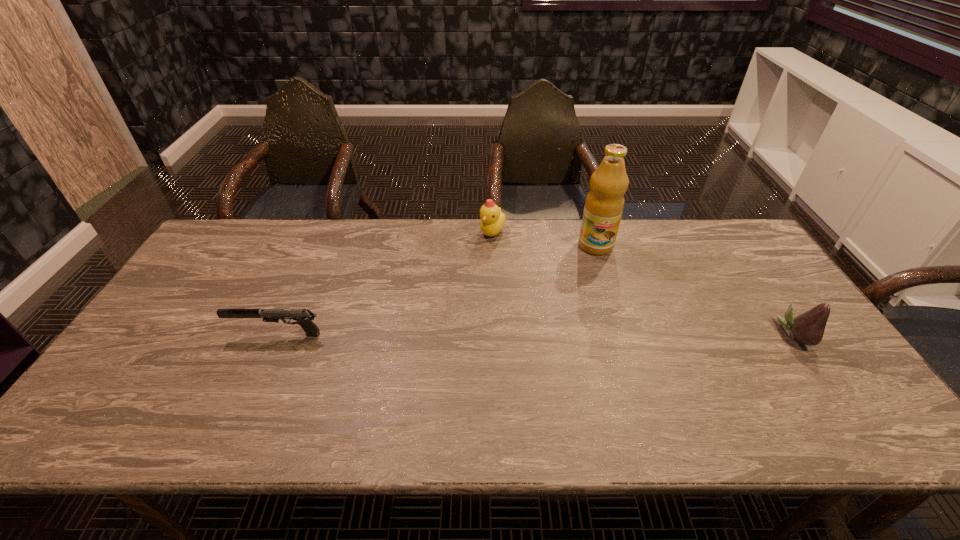
The height and width of the screenshot is (540, 960). I want to click on vacant region at the left edge of the desktop, so click(199, 282).

In the image, there is a desktop. Identify the location of free region at the right edge. (833, 372).

Locate an element on the screen. The image size is (960, 540). vacant area at the far left corner of the desktop is located at coordinates (241, 243).

This screenshot has width=960, height=540. Identify the location of vacant point at the far right corner. (710, 241).

The width and height of the screenshot is (960, 540). Identify the location of vacant region at the near right corner. (849, 397).

Locate an element on the screen. The height and width of the screenshot is (540, 960). vacant space in between the duckling and the shortest object is located at coordinates (385, 284).

Find the location of a particular element. The height and width of the screenshot is (540, 960). free space that is in between the olive oil and the leftmost object is located at coordinates (437, 290).

Where is `free point between the shortest object and the avocado`? The height and width of the screenshot is (540, 960). free point between the shortest object and the avocado is located at coordinates (536, 334).

Identify the location of unoccupied area between the olive oil and the duckling. (544, 239).

Where is `free space that is in between the rightmost object and the third object from left to right`? Image resolution: width=960 pixels, height=540 pixels. free space that is in between the rightmost object and the third object from left to right is located at coordinates (695, 290).